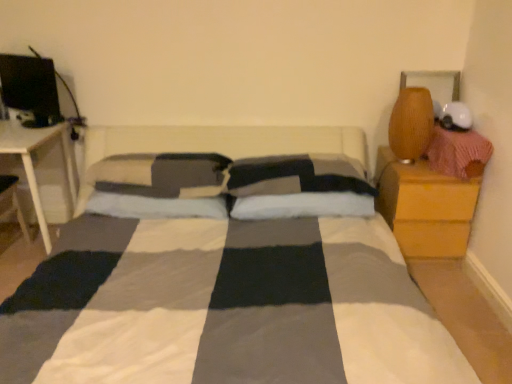
Based on the photo, in order to face checkered fabric pillow at center, acting as the 3th pillow starting from the left, should I rotate leftwards or rightwards?

Rotate right and turn 6.099 degrees.

Image resolution: width=512 pixels, height=384 pixels. What do you see at coordinates (297, 175) in the screenshot?
I see `checkered fabric pillow at center, acting as the 2th pillow starting from the right` at bounding box center [297, 175].

Measure the distance between point (57,111) and camera.

Point (57,111) and camera are 2.37 meters apart from each other.

Measure the distance between matte black monitor at upper left and camera.

2.28 meters.

Identify the location of soft gray pillow at center, acting as the 4th pillow starting from the right. This screenshot has width=512, height=384. (161, 174).

The width and height of the screenshot is (512, 384). What are the coordinates of `wooden nightstand at right` in the screenshot? It's located at (425, 207).

This screenshot has width=512, height=384. Find the location of `white soft pillow at center, which ranks as the first pillow in right-to-left order`. white soft pillow at center, which ranks as the first pillow in right-to-left order is located at coordinates (303, 205).

Considering the sizes of objects soft gray pillow at center, acting as the 4th pillow starting from the right, and white wood table at left in the image provided, who is bigger, soft gray pillow at center, acting as the 4th pillow starting from the right, or white wood table at left?

white wood table at left is bigger.

This screenshot has height=384, width=512. There is a white wood table at left. Identify the location of the 1st pillow above it (from the image's perspective). (161, 174).

Which is in front, soft gray pillow at center, marked as the first pillow in a left-to-right arrangement, or white wood table at left?

soft gray pillow at center, marked as the first pillow in a left-to-right arrangement, is closer to the camera.

From the image's perspective, is soft gray pillow at center, marked as the first pillow in a left-to-right arrangement, on white wood table at left?

Yes, from the image's perspective, soft gray pillow at center, marked as the first pillow in a left-to-right arrangement, is above white wood table at left.

Does matte black monitor at upper left touch soft gray pillow at center, which is counted as the second pillow, starting from the left?

No, matte black monitor at upper left is not beside soft gray pillow at center, which is counted as the second pillow, starting from the left.

Is matte black monitor at upper left positioned with its back to soft gray pillow at center, which is the 3th pillow in right-to-left order?

No, soft gray pillow at center, which is the 3th pillow in right-to-left order, is not at the back of matte black monitor at upper left.

Between matte black monitor at upper left and soft gray pillow at center, which is the 3th pillow in right-to-left order, which one is positioned behind?

Positioned behind is matte black monitor at upper left.

Can you confirm if wooden nightstand at right is positioned to the right of soft gray pillow at center, acting as the 4th pillow starting from the right?

Yes.

Which point is more forward, (450,231) or (176,187)?

Point (176,187)

Which object is wider, wooden nightstand at right or soft gray pillow at center, marked as the first pillow in a left-to-right arrangement?

wooden nightstand at right is wider.

Considering the sizes of objects wooden nightstand at right and soft gray pillow at center, acting as the 4th pillow starting from the right, in the image provided, who is taller, wooden nightstand at right or soft gray pillow at center, acting as the 4th pillow starting from the right,?

Standing taller between the two is wooden nightstand at right.

From a real-world perspective, is checkered fabric pillow at center, acting as the 2th pillow starting from the right, physically above white wood table at left?

Yes, from a real-world perspective, checkered fabric pillow at center, acting as the 2th pillow starting from the right, is on top of white wood table at left.

Could you tell me if checkered fabric pillow at center, acting as the 3th pillow starting from the left, is turned towards white wood table at left?

No, checkered fabric pillow at center, acting as the 3th pillow starting from the left, is not facing towards white wood table at left.

Which is further, (336, 167) or (29, 171)?

Point (29, 171)

Based on their positions, is checkered fabric pillow at center, acting as the 3th pillow starting from the left, located to the left or right of white wood table at left?

Clearly, checkered fabric pillow at center, acting as the 3th pillow starting from the left, is on the right of white wood table at left in the image.

Is soft gray pillow at center, which is counted as the second pillow, starting from the left, wider or thinner than white wood table at left?

soft gray pillow at center, which is counted as the second pillow, starting from the left, is thinner than white wood table at left.

Can white wood table at left be found inside soft gray pillow at center, which is counted as the second pillow, starting from the left?

No, white wood table at left is not surrounded by soft gray pillow at center, which is counted as the second pillow, starting from the left.

From a real-world perspective, which object rests below the other?

From a 3D spatial view, white wood table at left is below.

Is matte black monitor at upper left bigger or smaller than matte brown vase at upper right?

matte black monitor at upper left is bigger than matte brown vase at upper right.

Based on the photo, which object is wider, matte black monitor at upper left or matte brown vase at upper right?

matte brown vase at upper right.

In terms of height, does matte black monitor at upper left look taller or shorter compared to matte brown vase at upper right?

Clearly, matte black monitor at upper left is shorter compared to matte brown vase at upper right.

Is matte black monitor at upper left turned away from matte brown vase at upper right?

That's not correct — matte black monitor at upper left is not looking away from matte brown vase at upper right.

Which point is more forward, (28, 80) or (29, 130)?

The point (29, 130) is closer.

Is white wood table at left inside matte black monitor at upper left?

No, white wood table at left is not surrounded by matte black monitor at upper left.

From the image's perspective, between matte black monitor at upper left and white wood table at left, which one is located above?

matte black monitor at upper left is shown above in the image.

Considering the sizes of matte black monitor at upper left and white wood table at left in the image, is matte black monitor at upper left wider or thinner than white wood table at left?

In the image, matte black monitor at upper left appears to be more narrow than white wood table at left.

This screenshot has width=512, height=384. There is a white wood table at left. In order to click on the 1st pillow above it (from the image's perspective) in this screenshot , I will do `click(161, 174)`.

Identify the location of the 4th pillow below the matte black monitor at upper left (from the image's perspective). Image resolution: width=512 pixels, height=384 pixels. click(155, 206).

When comparing their distances from white wood table at left, does matte black monitor at upper left or matte brown vase at upper right seem closer?

matte black monitor at upper left is closer to white wood table at left.

When comparing their distances from checkered fabric pillow at center, acting as the 2th pillow starting from the right, does soft gray pillow at center, acting as the 4th pillow starting from the right, or white wood table at left seem closer?

Based on the image, soft gray pillow at center, acting as the 4th pillow starting from the right, appears to be nearer to checkered fabric pillow at center, acting as the 2th pillow starting from the right.

Looking at the image, which one is located further to checkered fabric pillow at center, acting as the 3th pillow starting from the left, matte brown vase at upper right or wooden nightstand at right?

The object further to checkered fabric pillow at center, acting as the 3th pillow starting from the left, is matte brown vase at upper right.

From the picture: Considering their positions, is soft gray pillow at center, which is counted as the second pillow, starting from the left, positioned closer to matte brown vase at upper right than checkered fabric pillow at center, acting as the 3th pillow starting from the left?

checkered fabric pillow at center, acting as the 3th pillow starting from the left.

Which object lies nearer to the anchor point white soft pillow at center, which is the 4th pillow in left-to-right order, white wood table at left or matte brown vase at upper right?

matte brown vase at upper right lies closer to white soft pillow at center, which is the 4th pillow in left-to-right order, than the other object.

From the image, which object appears to be farther from white wood table at left, checkered fabric pillow at center, acting as the 3th pillow starting from the left, or matte brown vase at upper right?

The object further to white wood table at left is matte brown vase at upper right.

Which object lies nearer to the anchor point wooden nightstand at right, white wood table at left or soft gray pillow at center, which is counted as the second pillow, starting from the left?

The object closer to wooden nightstand at right is soft gray pillow at center, which is counted as the second pillow, starting from the left.

Considering their positions, is wooden nightstand at right positioned closer to matte brown vase at upper right than matte black monitor at upper left?

Among the two, wooden nightstand at right is located nearer to matte brown vase at upper right.

Identify the location of pillow between checkered fabric pillow at center, acting as the 3th pillow starting from the left, and wooden nightstand at right. The width and height of the screenshot is (512, 384). (303, 205).

Find the location of a particular element. The image size is (512, 384). table lamp between white soft pillow at center, which is the 4th pillow in left-to-right order, and wooden nightstand at right, in the horizontal direction is located at coordinates (411, 124).

Where is `table lamp located between white wood table at left and wooden nightstand at right in the left-right direction`? table lamp located between white wood table at left and wooden nightstand at right in the left-right direction is located at coordinates (411, 124).

Image resolution: width=512 pixels, height=384 pixels. What are the coordinates of `table lamp between soft gray pillow at center, which is counted as the second pillow, starting from the left, and wooden nightstand at right, in the horizontal direction` in the screenshot? It's located at (411, 124).